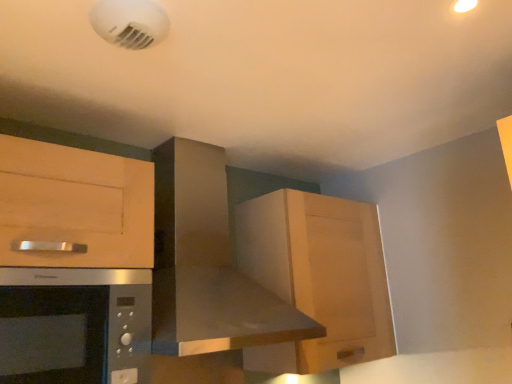
Question: Are wooden cabinet at upper right and satin silver microwave at lower left located far from each other?

Choices:
 (A) no
 (B) yes

Answer: (A)

Question: Is wooden cabinet at upper right turned away from satin silver microwave at lower left?

Choices:
 (A) yes
 (B) no

Answer: (B)

Question: Considering the relative sizes of wooden cabinet at upper right and satin silver microwave at lower left in the image provided, is wooden cabinet at upper right taller than satin silver microwave at lower left?

Choices:
 (A) no
 (B) yes

Answer: (B)

Question: Is wooden cabinet at upper right to the right of satin silver microwave at lower left from the viewer's perspective?

Choices:
 (A) no
 (B) yes

Answer: (B)

Question: From a real-world perspective, is wooden cabinet at upper right physically above satin silver microwave at lower left?

Choices:
 (A) yes
 (B) no

Answer: (A)

Question: Is wooden cabinet at upper right not within satin silver microwave at lower left?

Choices:
 (A) no
 (B) yes

Answer: (B)

Question: Can you confirm if wooden cabinet at upper right is bigger than stainless steel range hood at center?

Choices:
 (A) yes
 (B) no

Answer: (B)

Question: Does wooden cabinet at upper right have a lesser width compared to stainless steel range hood at center?

Choices:
 (A) yes
 (B) no

Answer: (A)

Question: Would you say wooden cabinet at upper right is a long distance from stainless steel range hood at center?

Choices:
 (A) yes
 (B) no

Answer: (B)

Question: Would you say stainless steel range hood at center is part of wooden cabinet at upper right's contents?

Choices:
 (A) no
 (B) yes

Answer: (A)

Question: Can you confirm if wooden cabinet at upper right is wider than stainless steel range hood at center?

Choices:
 (A) no
 (B) yes

Answer: (A)

Question: Does wooden cabinet at upper right lie in front of stainless steel range hood at center?

Choices:
 (A) yes
 (B) no

Answer: (B)

Question: Is satin silver microwave at lower left positioned behind wooden cabinet at upper right?

Choices:
 (A) yes
 (B) no

Answer: (B)